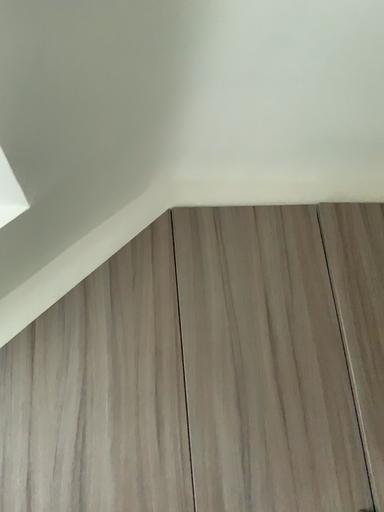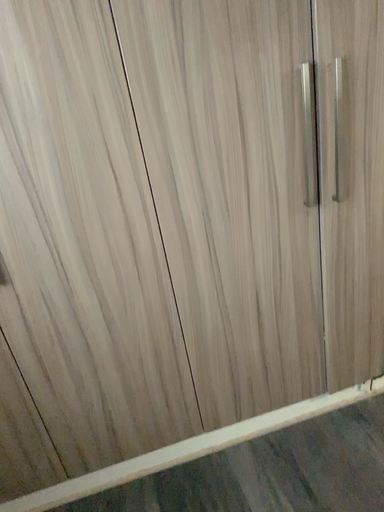
Question: Which way did the camera rotate in the video?

Choices:
 (A) rotated downward
 (B) rotated upward

Answer: (A)